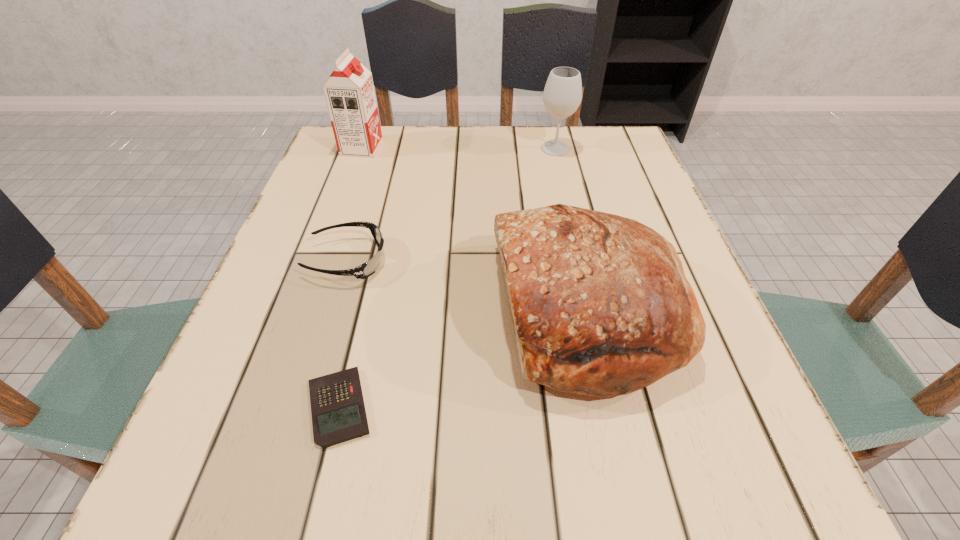
Find the location of a particular element. This screenshot has height=540, width=960. soya milk is located at coordinates (349, 92).

Locate an element on the screen. wineglass is located at coordinates point(562,95).

Image resolution: width=960 pixels, height=540 pixels. Identify the location of bread. (600, 304).

Find the location of a particular element. The image size is (960, 540). the second shortest object is located at coordinates (368, 268).

Find the location of a particular element. the shortest object is located at coordinates click(x=338, y=412).

Where is `vacant point located 0.330m on the right of the soya milk`? vacant point located 0.330m on the right of the soya milk is located at coordinates (513, 148).

Identify the location of vacant position located on the left of the wineglass. (458, 149).

The image size is (960, 540). Identify the location of vacant area located at the sliced front of the bread. (315, 311).

Locate an element on the screen. The height and width of the screenshot is (540, 960). free region located 0.090m at the sliced front of the bread is located at coordinates (441, 311).

I want to click on vacant space located 0.330m at the sliced front of the bread, so click(x=298, y=311).